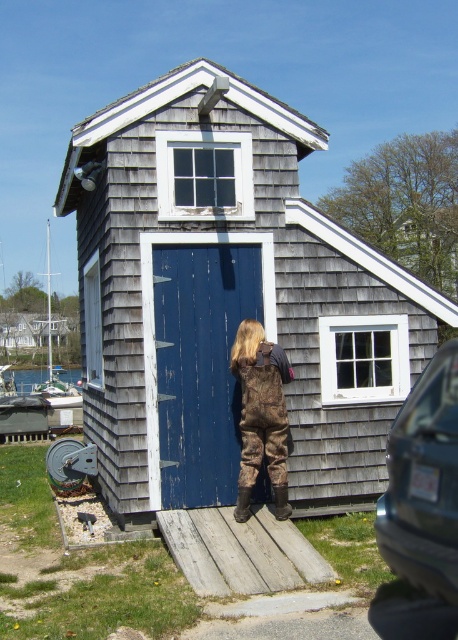
Question: Does blue weathered wood door at center have a smaller size compared to camouflage waders at center?

Choices:
 (A) no
 (B) yes

Answer: (A)

Question: Observing the image, what is the correct spatial positioning of gray shingled hut at center in reference to blue weathered wood door at center?

Choices:
 (A) left
 (B) right

Answer: (A)

Question: Observing the image, what is the correct spatial positioning of blue weathered wood door at center in reference to camouflage waders at center?

Choices:
 (A) below
 (B) above

Answer: (B)

Question: Among these objects, which one is nearest to the camera?

Choices:
 (A) camouflage waders at center
 (B) blue weathered wood door at center

Answer: (A)

Question: Estimate the real-world distances between objects in this image. Which object is farther from the camouflage waders at center?

Choices:
 (A) blue weathered wood door at center
 (B) gray shingled hut at center

Answer: (B)

Question: Among these objects, which one is nearest to the camera?

Choices:
 (A) camouflage waders at center
 (B) gray shingled hut at center

Answer: (B)